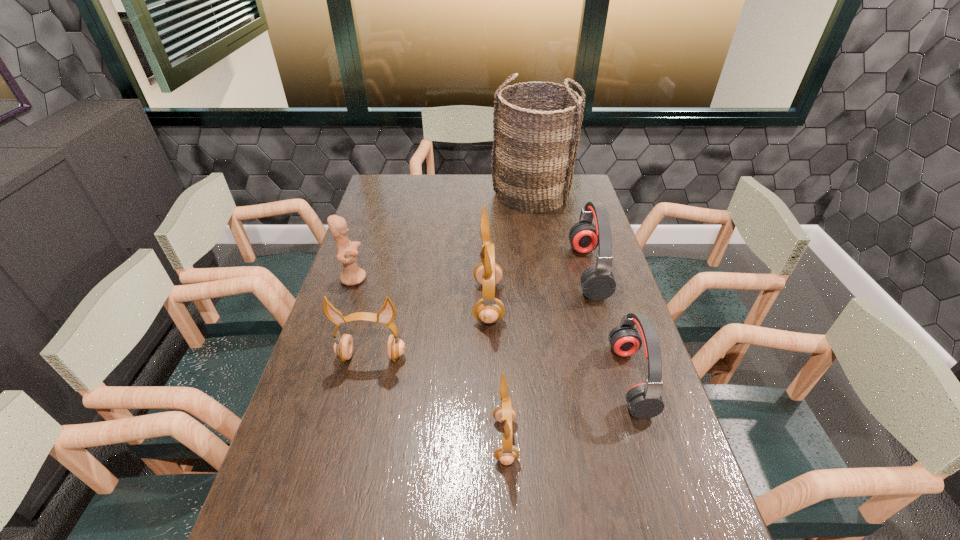
Find the location of `vacant space located on the front of the basket`. vacant space located on the front of the basket is located at coordinates (541, 260).

Locate an element on the screen. This screenshot has width=960, height=540. free space located on the front-facing side of the second tallest object is located at coordinates (378, 302).

You are a GUI agent. You are given a task and a screenshot of the screen. Output one action in this format:
    pyautogui.click(x=<x>, y=<y>)
    Task: Click on the vacant space located 0.390m on the front-facing side of the second tallest object
    The height and width of the screenshot is (540, 960).
    Given the screenshot: What is the action you would take?
    pyautogui.click(x=349, y=302)

At what (x,y) coordinates should I click in order to perform the action: click on vacant space located on the front-facing side of the second tallest object. Please return your answer as a coordinate pair (x, y). The height and width of the screenshot is (540, 960). Looking at the image, I should click on (422, 302).

Where is `vacant space located 0.130m on the ear cups of the farther red earphone`? The height and width of the screenshot is (540, 960). vacant space located 0.130m on the ear cups of the farther red earphone is located at coordinates (536, 271).

I want to click on free region located 0.280m on the ear cups of the farther red earphone, so click(492, 271).

Image resolution: width=960 pixels, height=540 pixels. I want to click on vacant space located on the ear cups of the farther red earphone, so click(x=489, y=271).

Find the location of `free spot located 0.390m on the front-facing side of the figurine`. free spot located 0.390m on the front-facing side of the figurine is located at coordinates (483, 278).

Identify the location of free space located on the front-facing side of the leftmost brown earphone. (351, 444).

This screenshot has width=960, height=540. In order to click on free space located on the ear cups of the smaller red earphone in this screenshot , I will do `click(488, 379)`.